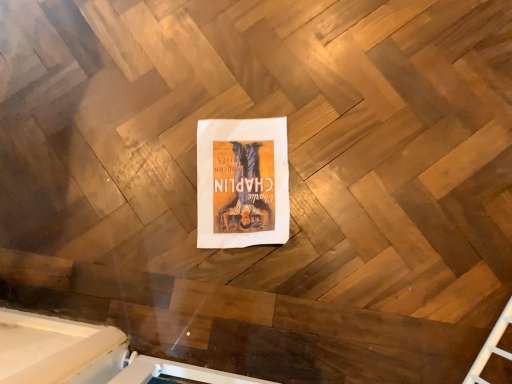
Locate an element on the screen. The height and width of the screenshot is (384, 512). free spot below white paper poster at center (from a real-world perspective) is located at coordinates (239, 177).